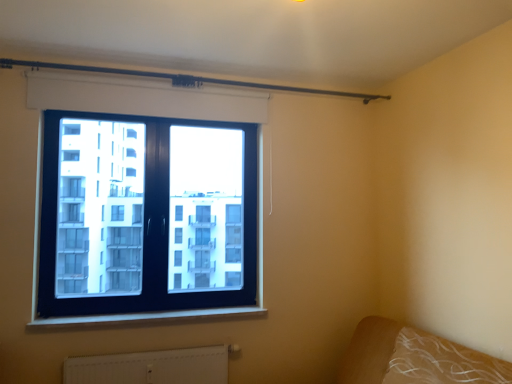
The height and width of the screenshot is (384, 512). In order to click on free area below black glass window at upper left (from a real-world perspective) in this screenshot , I will do `click(150, 311)`.